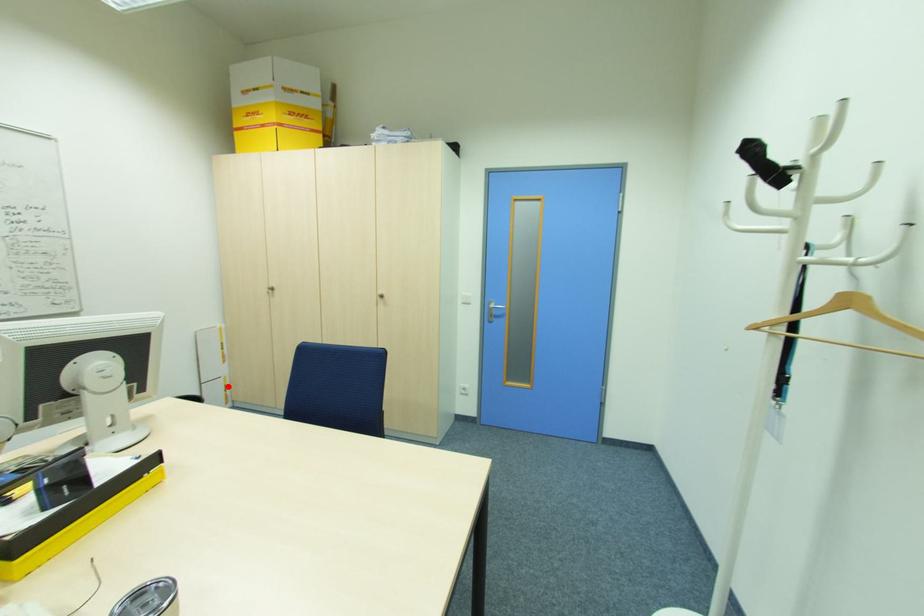
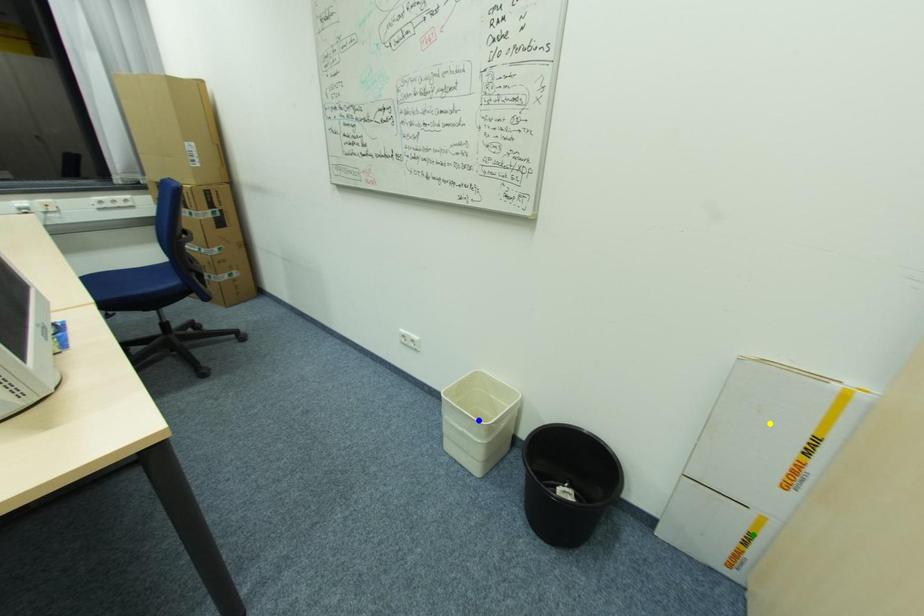
Question: I am providing you with two images of the same scene from different viewpoints. A red point is marked on the first image. You are given multiple points on the second image. In image 2, which mark is for the same physical point as the one in image 1?

Choices:
 (A) yellow point
 (B) blue point
 (C) green point

Answer: (C)